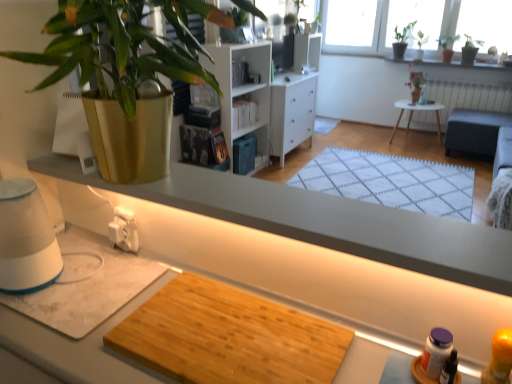
Question: Is wooden cutting board at center inside or outside of white painted radiator at upper right?

Choices:
 (A) outside
 (B) inside

Answer: (A)

Question: Considering the relative positions of wooden cutting board at center and white painted radiator at upper right in the image provided, is wooden cutting board at center to the left or to the right of white painted radiator at upper right?

Choices:
 (A) left
 (B) right

Answer: (A)

Question: Which object is positioned closest to the green leafy plant at upper right, marked as the first houseplant in a back-to-front arrangement?

Choices:
 (A) green leafy plant at upper right, which appears as the second houseplant when viewed from the right
 (B) white wood cabinet at center
 (C) wooden cutting board at center
 (D) gold metallic pot at upper left, arranged as the first houseplant when ordered from the bottom
 (E) white painted radiator at upper right

Answer: (A)

Question: Which of these objects is positioned farthest from the green leafy plant at upper right, marked as the first houseplant in a back-to-front arrangement?

Choices:
 (A) white wooden table at center
 (B) white painted radiator at upper right
 (C) white wood cabinet at center
 (D) gold metallic pot at upper left, which is counted as the 4th houseplant, starting from the top
 (E) white woven mat at center

Answer: (D)